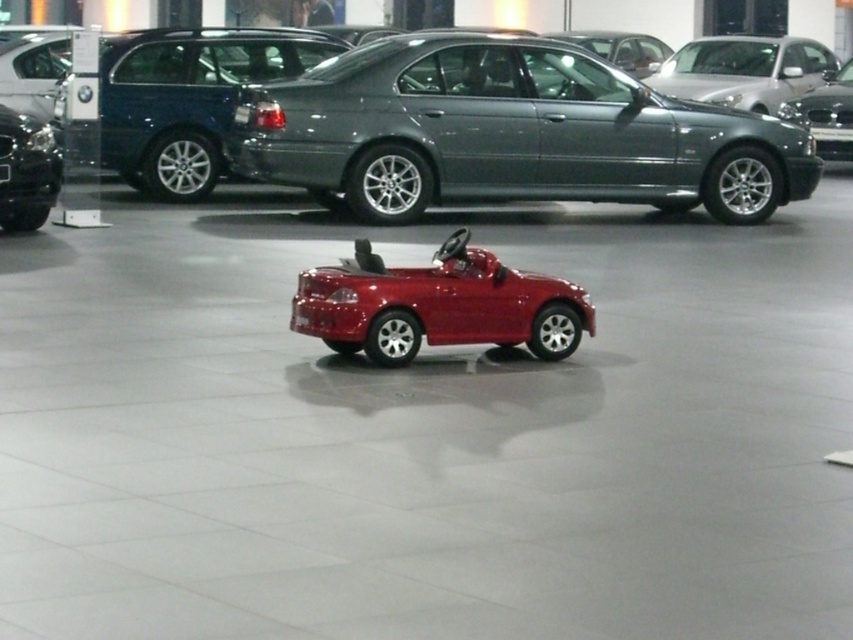
Which is behind, point (318, 300) or point (827, 109)?

Positioned behind is point (827, 109).

Is point (390, 344) in front of point (824, 108)?

Yes, point (390, 344) is closer to viewer.

Identify the location of shiny red toy car at center. This screenshot has height=640, width=853. pos(438,305).

Which is more to the left, satin silver sedan at upper right or glossy metallic sedan at upper right?

Positioned to the left is satin silver sedan at upper right.

Which is more to the right, satin silver sedan at upper right or glossy metallic sedan at upper right?

Positioned to the right is glossy metallic sedan at upper right.

Is point (793, 76) closer to viewer compared to point (833, 70)?

Yes.

You are a GUI agent. You are given a task and a screenshot of the screen. Output one action in this format:
    pyautogui.click(x=<x>, y=<y>)
    Task: Click on the satin silver sedan at upper right
    Image resolution: width=853 pixels, height=640 pixels.
    Given the screenshot: What is the action you would take?
    tap(744, 70)

Where is `metallic gray sedan at center`? metallic gray sedan at center is located at coordinates (508, 132).

Does metallic gray sedan at center have a larger size compared to satin silver sedan at upper right?

Indeed, metallic gray sedan at center has a larger size compared to satin silver sedan at upper right.

Between point (315, 106) and point (805, 49), which one is positioned behind?

Positioned behind is point (805, 49).

I want to click on metallic gray sedan at center, so click(508, 132).